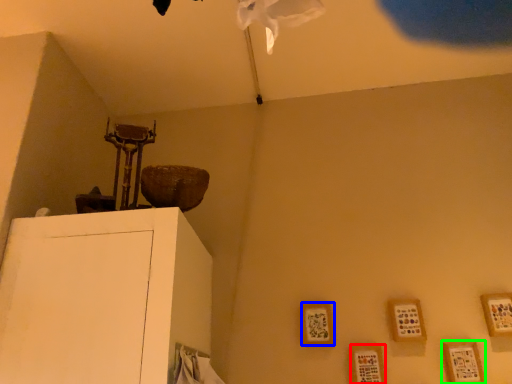
Question: Which is farther away from picture frame (highlighted by a red box)? picture frame (highlighted by a blue box) or picture frame (highlighted by a green box)?

Choices:
 (A) picture frame
 (B) picture frame

Answer: (B)